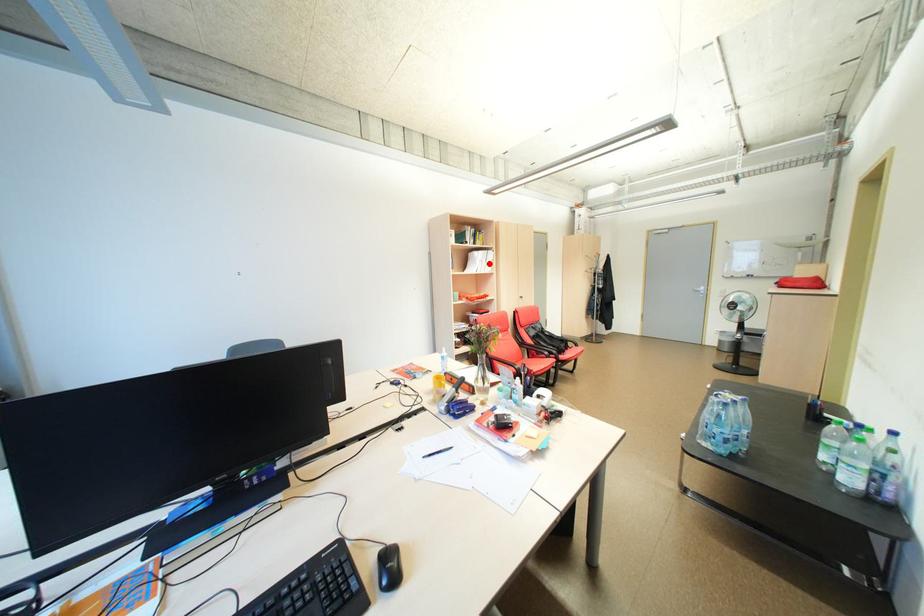
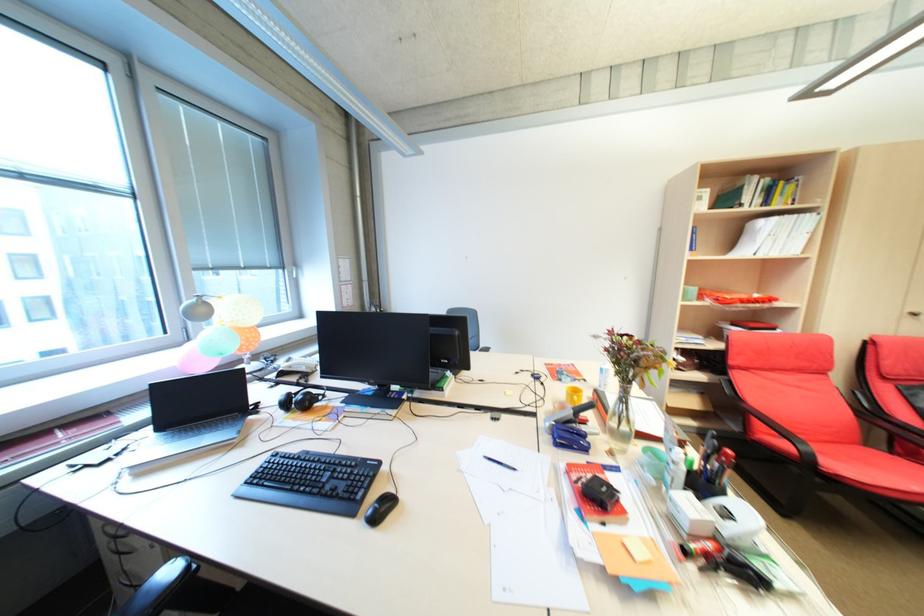
In the second image, find the point that corresponds to the highlighted location in the first image.

(784, 240)